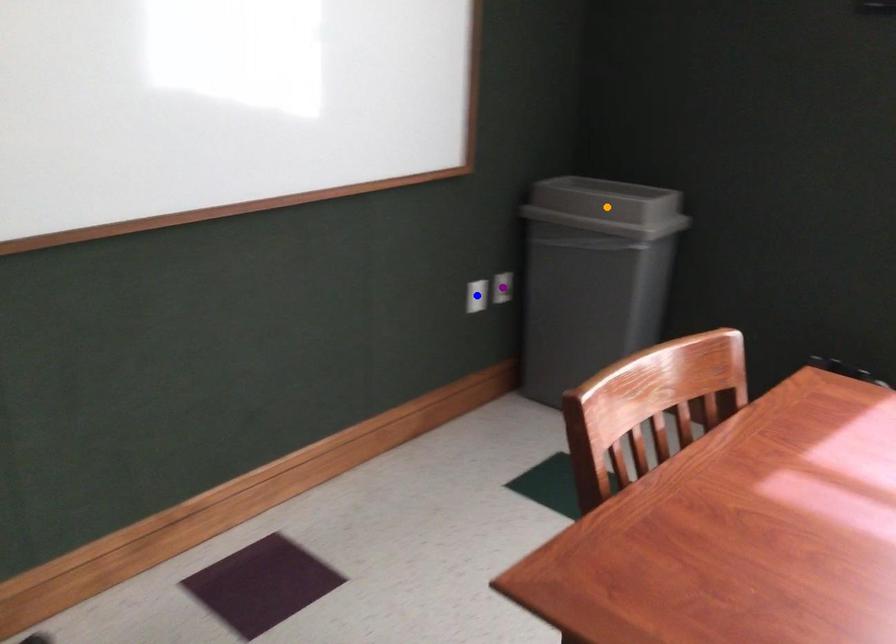
Order these from nearest to farthest:
A) orange point
B) purple point
C) blue point

purple point < blue point < orange point